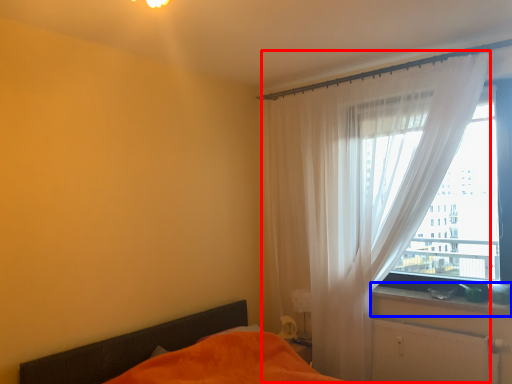
Question: Which object is further to the camera taking this photo, curtain (highlighted by a red box) or window sill (highlighted by a blue box)?

Choices:
 (A) curtain
 (B) window sill

Answer: (B)